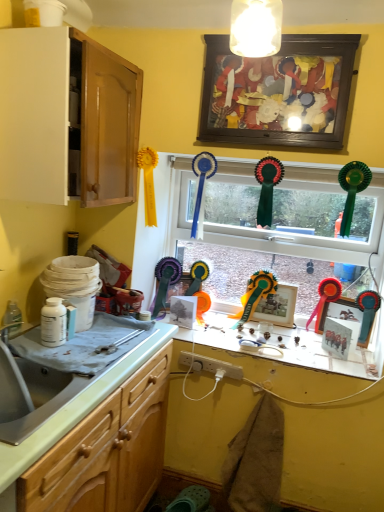
Where is `blank space situated above wooden picture frame at upper center, which ranks as the first picture frame in top-to-bottom order (from a real-world perspective)`? The width and height of the screenshot is (384, 512). blank space situated above wooden picture frame at upper center, which ranks as the first picture frame in top-to-bottom order (from a real-world perspective) is located at coordinates (303, 33).